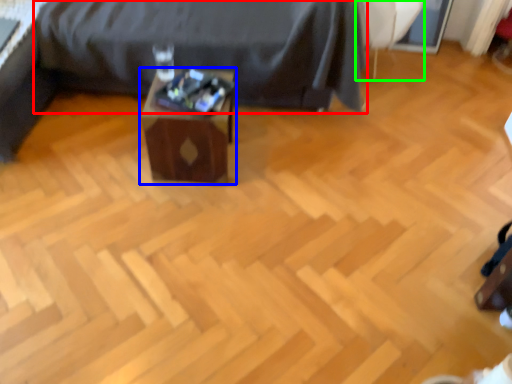
Question: Which object is positioned farthest from furniture (highlighted by a red box)? Select from table (highlighted by a blue box) and swivel chair (highlighted by a green box).

Choices:
 (A) table
 (B) swivel chair

Answer: (B)